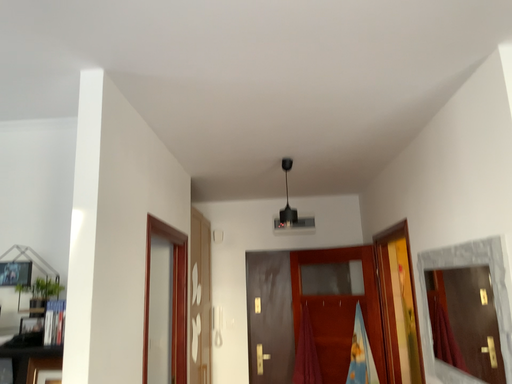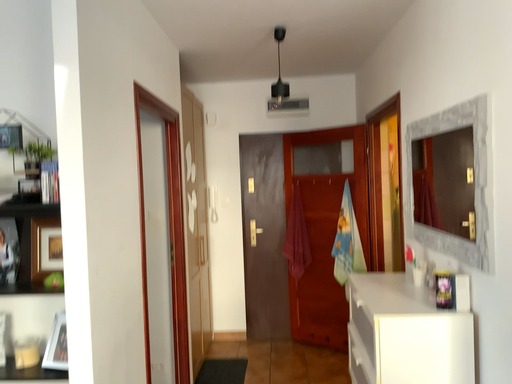
Question: Which way did the camera rotate in the video?

Choices:
 (A) rotated upward
 (B) rotated downward

Answer: (B)